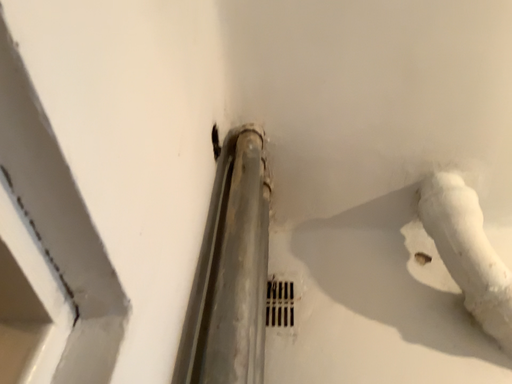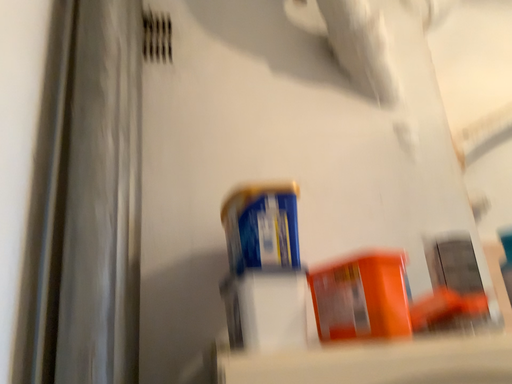
Question: How did the camera likely rotate when shooting the video?

Choices:
 (A) rotated right
 (B) rotated left

Answer: (A)